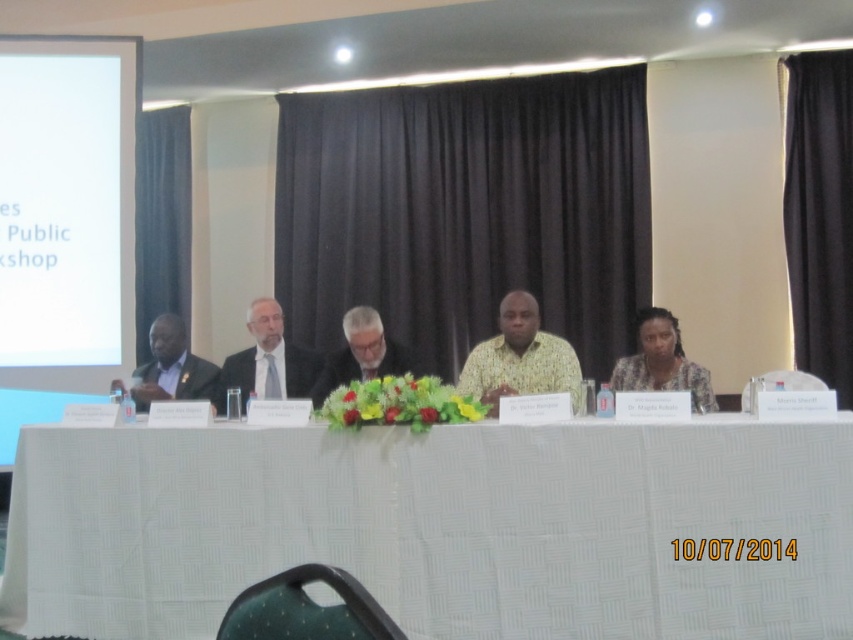
Question: Can you confirm if black fabric curtain at center is positioned above matte black dress at center?

Choices:
 (A) yes
 (B) no

Answer: (A)

Question: Which object is closer to the camera taking this photo?

Choices:
 (A) matte black dress at center
 (B) black fabric curtain at right
 (C) matte black suit at left

Answer: (A)

Question: Which point is closer to the camera?

Choices:
 (A) gray hair and beard at center
 (B) black fabric curtain at left

Answer: (A)

Question: Which is nearer to the gray hair and beard at center?

Choices:
 (A) matte black suit at center
 (B) matte black suit at left
 (C) black fabric curtain at center

Answer: (A)

Question: Is the position of white textured table at center more distant than that of matte black dress at center?

Choices:
 (A) no
 (B) yes

Answer: (A)

Question: Can you confirm if white textured table at center is thinner than matte black suit at center?

Choices:
 (A) yes
 (B) no

Answer: (B)